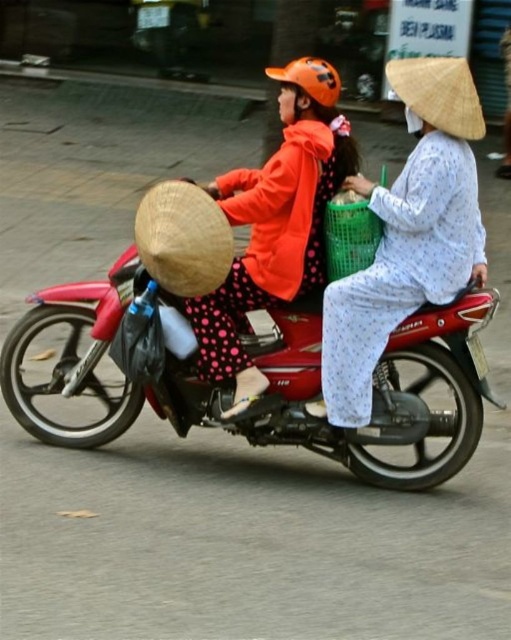
You are a delivery person who needs to place a package on the red matte motorcycle at center and the natural straw hat at upper right. Which object can you place the package on without it falling off?

The red matte motorcycle at center has a larger size compared to natural straw hat at upper right, so the package can be placed on the red matte motorcycle at center without falling off.

You are a pedestrian standing on the sidewalk next to the street. You see the red matte motorcycle at center and the natural straw hat at upper right. Which object is closer to you?

The natural straw hat at upper right is behind the red matte motorcycle at center, so the red matte motorcycle at center is closer to you.

You are a photographer trying to capture both the orange matte helmet at upper center and the natural straw hat at center in a single frame. Based on their sizes, which object should you focus on to ensure both are clearly visible without cropping?

The orange matte helmet at upper center has a larger width than the natural straw hat at center. To ensure both are clearly visible without cropping, focus on the orange matte helmet at upper center as it requires more space due to its larger size.